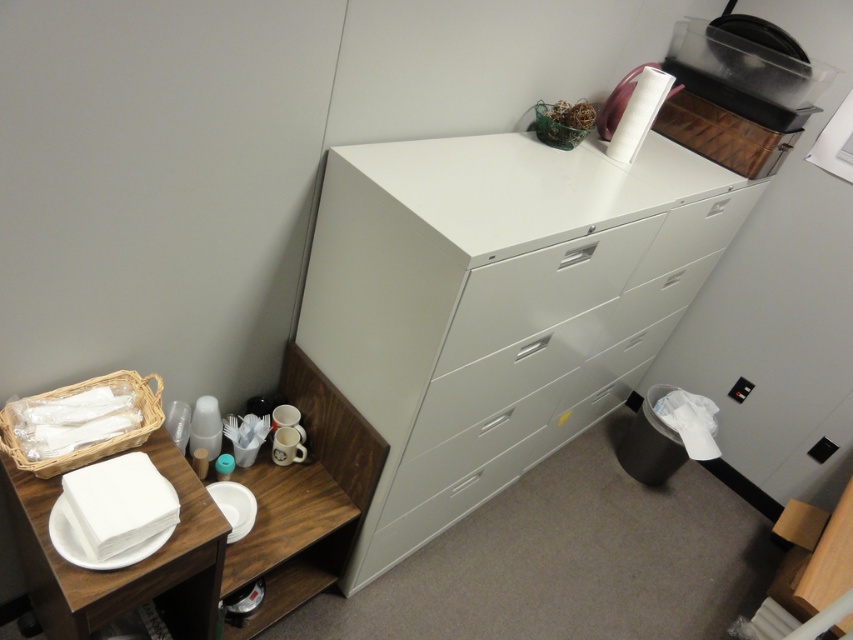
Question: Which of the following is the closest to the observer?

Choices:
 (A) (222, 500)
 (B) (570, 304)
 (C) (419, 448)
 (D) (112, 600)

Answer: (D)

Question: Which object appears closest to the camera in this image?

Choices:
 (A) white paper plate at lower left
 (B) white matte drawer at center
 (C) white matte/file cabinet at upper center

Answer: (A)

Question: Can you confirm if white matte/file cabinet at upper center is bigger than white matte plate at lower left?

Choices:
 (A) no
 (B) yes

Answer: (B)

Question: Which of the following is the farthest from the observer?

Choices:
 (A) white paper plate at lower left
 (B) white matte drawer at center
 (C) white paper napkins at left
 (D) white matte/file cabinet at upper center

Answer: (B)

Question: Does white matte/file cabinet at upper center have a larger size compared to white matte drawer at center?

Choices:
 (A) yes
 (B) no

Answer: (A)

Question: Can you confirm if white paper napkins at left is bigger than white matte plate at lower left?

Choices:
 (A) no
 (B) yes

Answer: (B)